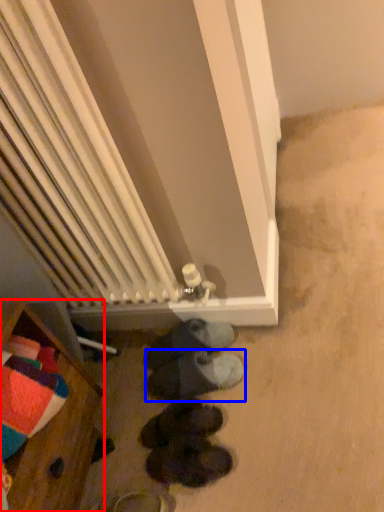
Question: Which object is closer to the camera taking this photo, furniture (highlighted by a red box) or footwear (highlighted by a blue box)?

Choices:
 (A) furniture
 (B) footwear

Answer: (A)